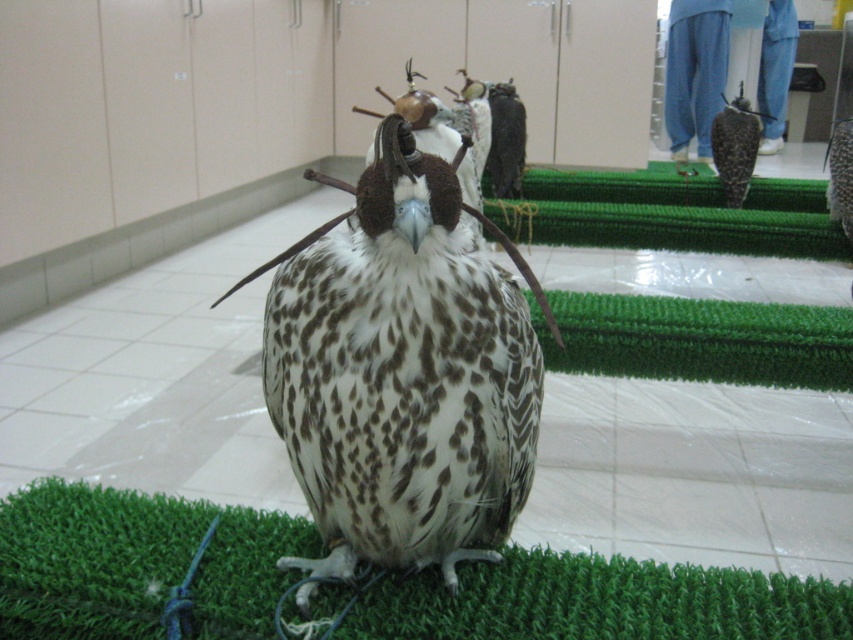
You are a falcon trainer observing the speckled feathered falcon at center and the green artificial turf at center. Which object is closer to your viewpoint?

The speckled feathered falcon at center is closer to your viewpoint than the green artificial turf at center, as it is positioned in front of the turf.

You are a falconer observing the scene. You notice a point at coordinate (136, 563). What is located at this point?

The green artificial turf at center is located at point (136, 563).

You are a wildlife photographer who wants to capture the speckled feathered falcon at center in a photo. Since the green artificial turf at center is part of the background, will the falcon be larger than the turf in the photo?

The speckled feathered falcon at center is bigger than the green artificial turf at center, so yes, the falcon will appear larger than the turf in the photo.